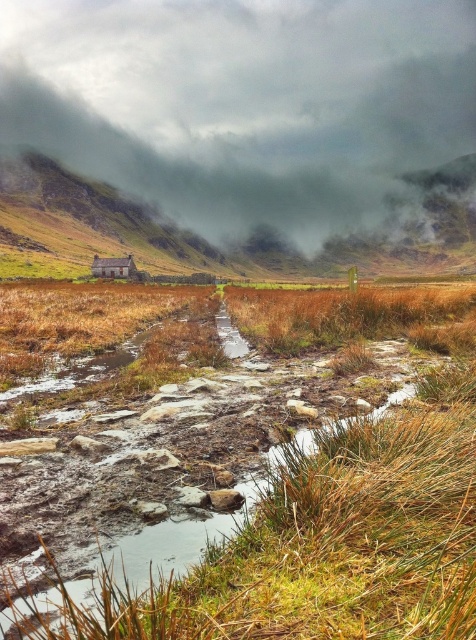
Question: Which of the following is the closest to the observer?

Choices:
 (A) brown grassy hillside at center
 (B) gray foggy cloud at upper center
 (C) brown wooden hut at center

Answer: (A)

Question: Considering the real-world distances, which object is closest to the brown wooden hut at center?

Choices:
 (A) brown grassy hillside at center
 (B) gray foggy cloud at upper center

Answer: (A)

Question: Is gray foggy cloud at upper center to the left of brown grassy hillside at center from the viewer's perspective?

Choices:
 (A) no
 (B) yes

Answer: (B)

Question: In this image, where is brown grassy hillside at center located relative to brown wooden hut at center?

Choices:
 (A) right
 (B) left

Answer: (A)

Question: Which object is the farthest from the brown grassy hillside at center?

Choices:
 (A) gray foggy cloud at upper center
 (B) brown wooden hut at center

Answer: (A)

Question: Does brown grassy hillside at center appear on the right side of brown wooden hut at center?

Choices:
 (A) no
 (B) yes

Answer: (B)